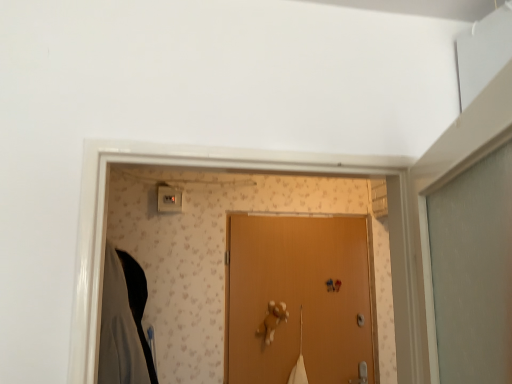
Where is `white plastic light switch at upper center`? Image resolution: width=512 pixels, height=384 pixels. white plastic light switch at upper center is located at coordinates (169, 199).

What is the approximate width of wooden door at center?

wooden door at center is 1.58 inches wide.

What do you see at coordinates (124, 322) in the screenshot? The height and width of the screenshot is (384, 512). I see `black matte robe at left` at bounding box center [124, 322].

This screenshot has width=512, height=384. Find the location of `white plastic light switch at upper center`. white plastic light switch at upper center is located at coordinates (169, 199).

Considering the points (165, 201) and (124, 355), which point is behind, point (165, 201) or point (124, 355)?

The point (165, 201) is behind.

Is white plastic light switch at upper center aimed at black matte robe at left?

No.

Looking at their sizes, would you say white plastic light switch at upper center is wider or thinner than black matte robe at left?

white plastic light switch at upper center is thinner than black matte robe at left.

This screenshot has height=384, width=512. I want to click on robe in front of the white plastic light switch at upper center, so click(124, 322).

Which of these two, black matte robe at left or white plastic light switch at upper center, is smaller?

white plastic light switch at upper center is smaller.

Where is `light switch above the black matte robe at left (from a real-world perspective)`? This screenshot has width=512, height=384. light switch above the black matte robe at left (from a real-world perspective) is located at coordinates (169, 199).

Consider the image. Is black matte robe at left not inside white plastic light switch at upper center?

Yes, black matte robe at left is outside of white plastic light switch at upper center.

In terms of width, does black matte robe at left look wider or thinner when compared to white plastic light switch at upper center?

Clearly, black matte robe at left has more width compared to white plastic light switch at upper center.

Is black matte robe at left in front of wooden door at center?

That is True.

Which of these two, black matte robe at left or wooden door at center, is bigger?

black matte robe at left is bigger.

Is wooden door at center located within black matte robe at left?

Definitely not — wooden door at center is not inside black matte robe at left.

From a real-world perspective, is black matte robe at left located higher than wooden door at center?

Indeed, from a real-world perspective, black matte robe at left stands above wooden door at center.

Considering the sizes of objects wooden door at center and white plastic light switch at upper center in the image provided, who is wider, wooden door at center or white plastic light switch at upper center?

With larger width is white plastic light switch at upper center.

Could you tell me if wooden door at center is facing white plastic light switch at upper center?

No.

Considering the positions of points (280, 243) and (170, 199), is point (280, 243) closer to camera compared to point (170, 199)?

That is False.

Is the position of wooden door at center less distant than that of white plastic light switch at upper center?

Yes, wooden door at center is closer to the camera.

Is wooden door at center closer to camera compared to black matte robe at left?

No, the depth of wooden door at center is greater than that of black matte robe at left.

Does point (281, 380) lie in front of point (139, 344)?

That is False.

Is white plastic light switch at upper center facing away from wooden door at center?

No, white plastic light switch at upper center is not facing away from wooden door at center.

Which object is wider, white plastic light switch at upper center or wooden door at center?

Wider between the two is white plastic light switch at upper center.

Is point (162, 193) closer or farther from the camera than point (341, 382)?

Point (162, 193).

Find the location of a particular element. light switch that appears above the black matte robe at left (from the image's perspective) is located at coordinates (169, 199).

At what (x,y) coordinates should I click in order to perform the action: click on light switch that appears above the black matte robe at left (from a real-world perspective). Please return your answer as a coordinate pair (x, y). Looking at the image, I should click on (169, 199).

From the image, which object appears to be farther from white plastic light switch at upper center, black matte robe at left or wooden door at center?

Based on the image, wooden door at center appears to be further to white plastic light switch at upper center.

Considering their positions, is white plastic light switch at upper center positioned further to wooden door at center than black matte robe at left?

white plastic light switch at upper center lies further to wooden door at center than the other object.

Which object lies nearer to the anchor point black matte robe at left, white plastic light switch at upper center or wooden door at center?

Among the two, white plastic light switch at upper center is located nearer to black matte robe at left.

Which object lies further to the anchor point white plastic light switch at upper center, wooden door at center or black matte robe at left?

Based on the image, wooden door at center appears to be further to white plastic light switch at upper center.

Estimate the real-world distances between objects in this image. Which object is further from wooden door at center, black matte robe at left or white plastic light switch at upper center?

Among the two, white plastic light switch at upper center is located further to wooden door at center.

Considering their positions, is wooden door at center positioned further to black matte robe at left than white plastic light switch at upper center?

The object further to black matte robe at left is wooden door at center.

You are a GUI agent. You are given a task and a screenshot of the screen. Output one action in this format:
    pyautogui.click(x=<x>, y=<y>)
    Task: Click on the light switch situated between black matte robe at left and wooden door at center from left to right
    
    Given the screenshot: What is the action you would take?
    pyautogui.click(x=169, y=199)